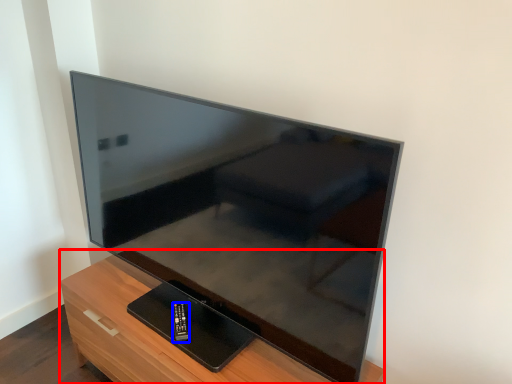
Question: Which point is further to the camera, furniture (highlighted by a red box) or control (highlighted by a blue box)?

Choices:
 (A) furniture
 (B) control

Answer: (B)